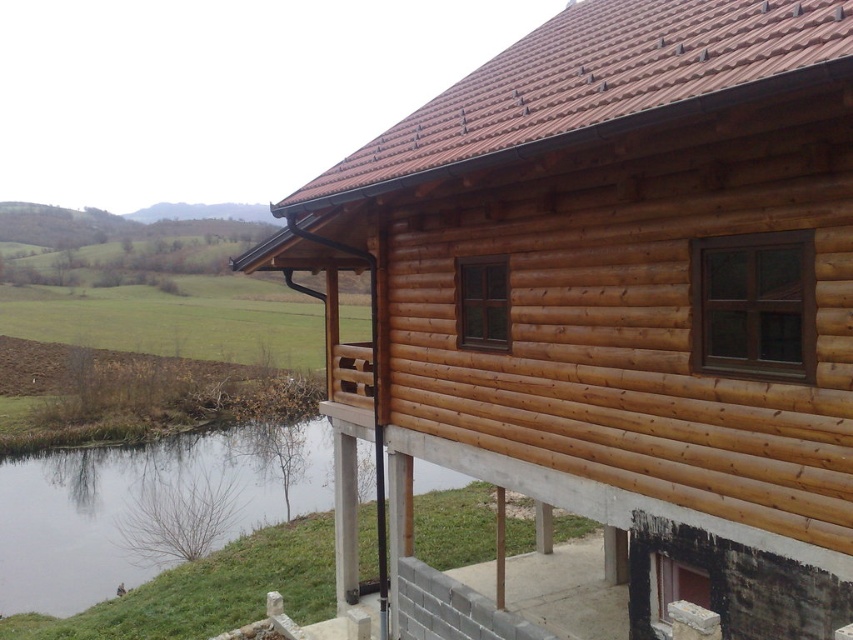
You are planning to build a new cabin similar to the natural wood cabin at upper right. The green grassy river at lower left is a popular spot for visitors. If you want your new cabin to have a similar width to the river, how should you adjust the size of your cabin compared to the existing one?

The natural wood cabin at upper right has a lesser width compared to the green grassy river at lower left. To match the river width, you should build your new cabin wider than the existing cabin.